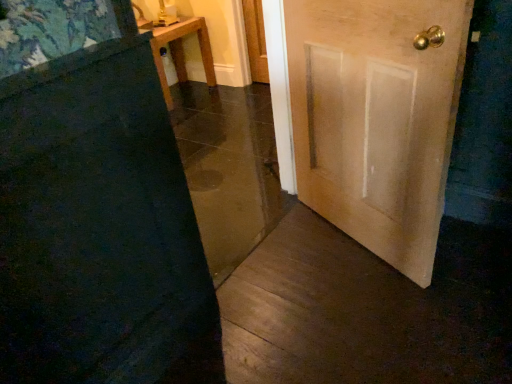
Where is `vacant point to the left of light brown wooden door at right, which is the 1th door in right-to-left order`? This screenshot has height=384, width=512. vacant point to the left of light brown wooden door at right, which is the 1th door in right-to-left order is located at coordinates (293, 276).